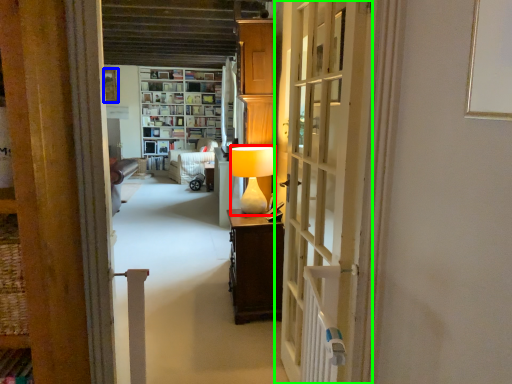
Question: Considering the real-world distances, which object is farthest from table lamp (highlighted by a red box)? picture frame (highlighted by a blue box) or door (highlighted by a green box)?

Choices:
 (A) picture frame
 (B) door

Answer: (A)